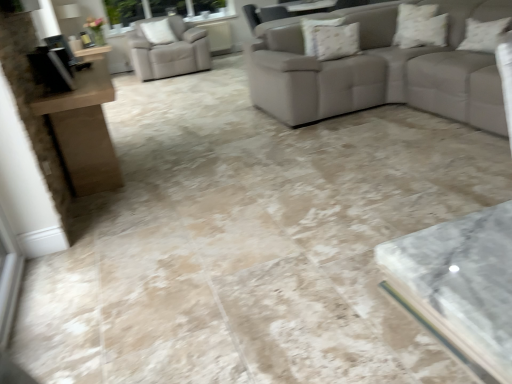
Question: Does white textured pillow at upper right, which is counted as the 3th pillow, starting from the left, come in front of beige leather armchair at upper left?

Choices:
 (A) no
 (B) yes

Answer: (B)

Question: Is beige leather armchair at upper left at the back of white textured pillow at upper right, marked as the 3th pillow in a back-to-front arrangement?

Choices:
 (A) yes
 (B) no

Answer: (B)

Question: From a real-world perspective, is white textured pillow at upper right, which ranks as the second pillow in front-to-back order, on beige leather armchair at upper left?

Choices:
 (A) yes
 (B) no

Answer: (A)

Question: Are white textured pillow at upper right, which is the 3th pillow from bottom to top, and beige leather armchair at upper left located far from each other?

Choices:
 (A) yes
 (B) no

Answer: (A)

Question: From the image's perspective, is white textured pillow at upper right, which is the 3th pillow from bottom to top, on beige leather armchair at upper left?

Choices:
 (A) yes
 (B) no

Answer: (B)

Question: Does white textured pillow at upper right, which is the 3th pillow from bottom to top, have a greater width compared to beige leather armchair at upper left?

Choices:
 (A) no
 (B) yes

Answer: (B)

Question: Considering the relative sizes of white textured pillow at upper right, arranged as the second pillow when viewed from the top, and white textured pillow at upper left, arranged as the fourth pillow when viewed from the front, in the image provided, is white textured pillow at upper right, arranged as the second pillow when viewed from the top, taller than white textured pillow at upper left, arranged as the fourth pillow when viewed from the front,?

Choices:
 (A) no
 (B) yes

Answer: (A)

Question: Is white textured pillow at upper right, marked as the 3th pillow in a back-to-front arrangement, in contact with white textured pillow at upper left, placed as the fourth pillow when sorted from bottom to top?

Choices:
 (A) no
 (B) yes

Answer: (A)

Question: From the image's perspective, would you say white textured pillow at upper right, which is counted as the 3th pillow, starting from the left, is positioned over white textured pillow at upper left, placed as the fourth pillow when sorted from bottom to top?

Choices:
 (A) yes
 (B) no

Answer: (B)

Question: Does white textured pillow at upper right, the 2th pillow viewed from the right, have a greater width compared to white textured pillow at upper left, placed as the fourth pillow when sorted from bottom to top?

Choices:
 (A) no
 (B) yes

Answer: (B)

Question: Would you say white textured pillow at upper right, the 2th pillow viewed from the right, is a long distance from white textured pillow at upper left, positioned as the 1th pillow in left-to-right order?

Choices:
 (A) yes
 (B) no

Answer: (A)

Question: Does white textured pillow at upper right, arranged as the second pillow when viewed from the top, come in front of white textured pillow at upper left, placed as the fourth pillow when sorted from bottom to top?

Choices:
 (A) no
 (B) yes

Answer: (B)

Question: From a real-world perspective, is beige leather armchair at upper left under floral fabric pillow at upper center, which is the 2th pillow in left-to-right order?

Choices:
 (A) no
 (B) yes

Answer: (B)